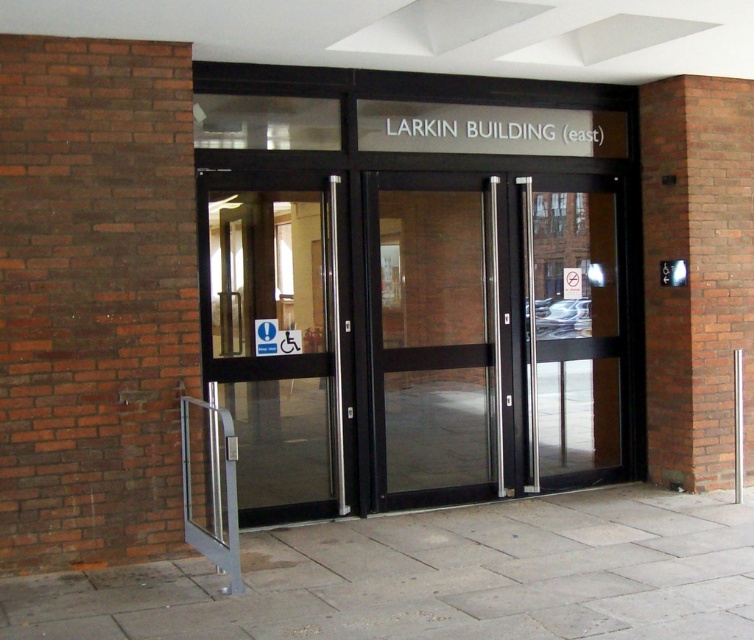
You are standing at the entrance of the Larkin Building and want to reach the point marked at coordinates point. (250, 465). Can you estimate how far you need to walk from your current position?

The distance of point point. (250, 465) from viewer is 6.54 meters, so you need to walk approximately 6.54 meters to reach it.

Based on the photo, you are a wheelchair user approaching the entrance of the Larkin Building. You see the transparent glass door at left with a blue sign. Where should you go to enter?

The transparent glass door at left is the accessible entrance, as indicated by the blue sign with a white exclamation mark and a wheelchair symbol affixed to it. Proceed to the transparent glass door at left to enter.

You are a delivery person with a 36 inch wide cart. You need to enter the Larkin Building through the entrance shown. There are two transparent glass doors available. Can you fit your cart through the space between the transparent glass door at left and the transparent glass door at center?

The transparent glass door at left and transparent glass door at center are 32.57 inches apart from each other. Since your cart is 36 inches wide, it is wider than the available space. You cannot fit your cart through the space between the transparent glass door at left and the transparent glass door at center.